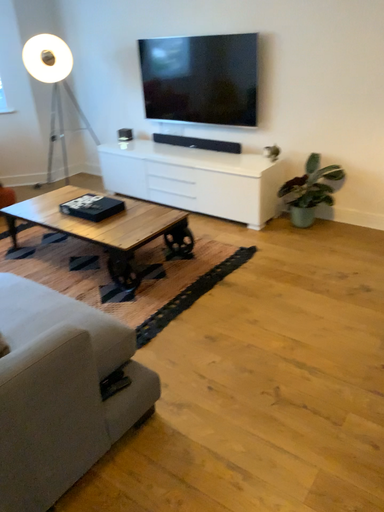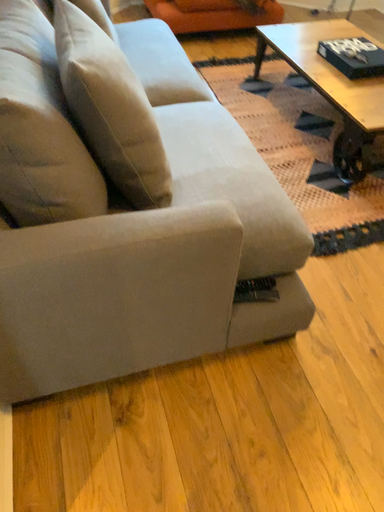
Question: Which way did the camera rotate in the video?

Choices:
 (A) rotated upward
 (B) rotated downward

Answer: (B)